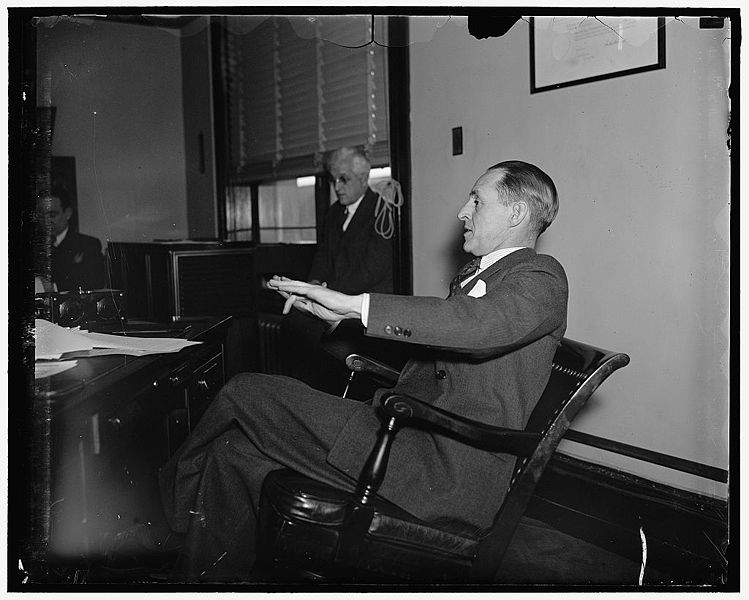
I want to click on walls, so click(x=628, y=166), click(x=111, y=147).